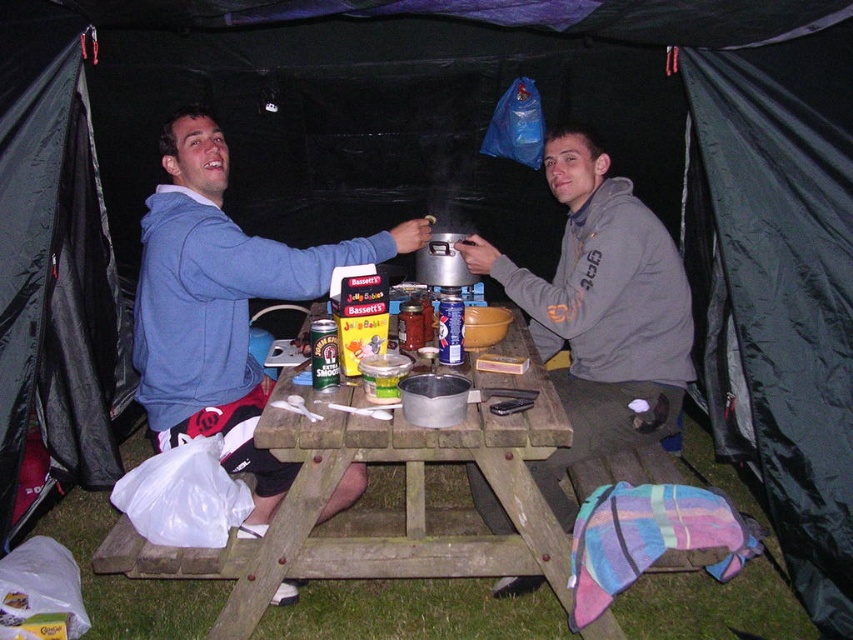
You are planning to set up a tent in your backyard and want to ensure there is enough space between the black nylon tent at left and the wooden picnic table at center for a 2 meter long camping chair. Is there sufficient space based on the image?

The wooden picnic table at center is behind the black nylon tent at left, so the distance between them is not specified. The image does not provide enough information to determine if there is enough space for a 2 meter long camping chair between the black nylon tent at left and the wooden picnic table at center.

You are setting up a tent for a camping trip and want to place a picnic table in the center. According to the image, where should you position the wooden picnic table at center?

The wooden picnic table at center is located at point (408, 492).